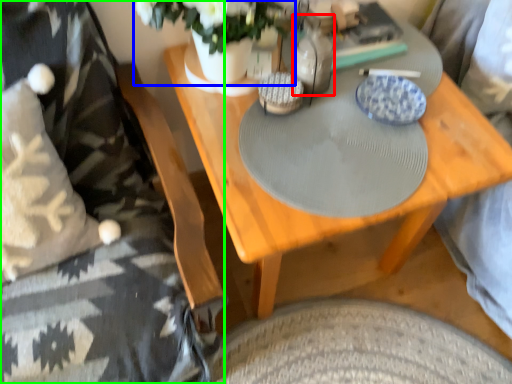
Question: Estimate the real-world distances between objects in this image. Which object is closer to bottle (highlighted by a red box), floral arrangement (highlighted by a blue box) or bedding (highlighted by a green box)?

Choices:
 (A) floral arrangement
 (B) bedding

Answer: (A)